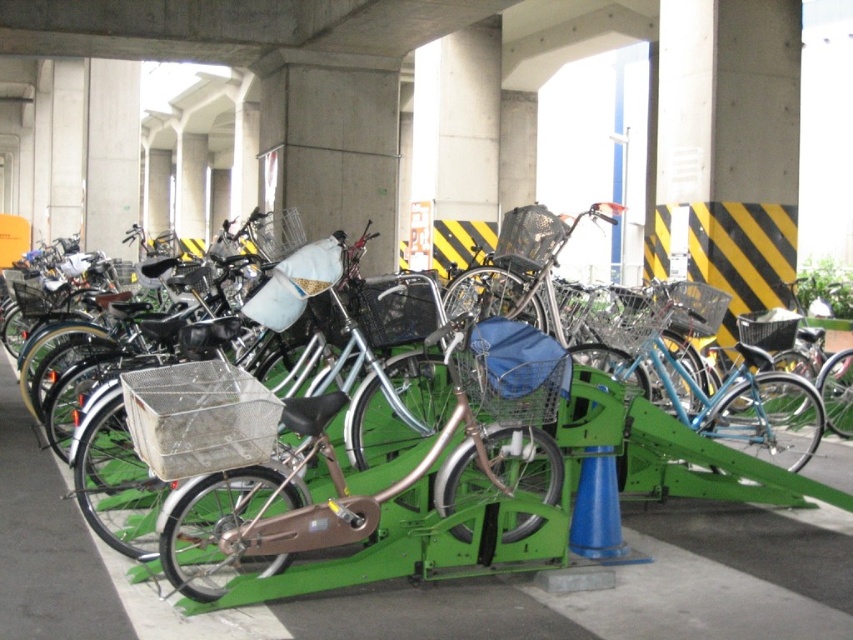
You are a cyclist who wants to retrieve your metallic silver bicycle at center from the parking area. However, there is another silver metallic bicycle at center blocking it. Can you easily access your bicycle?

The metallic silver bicycle at center is positioned under the silver metallic bicycle at center, so you cannot easily access your bicycle without moving the one above it.

You are standing in the bicycle parking area and see the metallic silver bicycle at center and the silver metallic bicycle at center. Which one is positioned more to the left?

The metallic silver bicycle at center is positioned to the left of the silver metallic bicycle at center.

You are a cyclist who wants to retrieve your metallic silver bicycle at center from the parking area. There is another silver metallic bicycle at center blocking your path. Can you easily access your bike?

The metallic silver bicycle at center is in front of the silver metallic bicycle at center, so you can easily access your metallic silver bicycle at center since it is not blocked by the other bicycle.